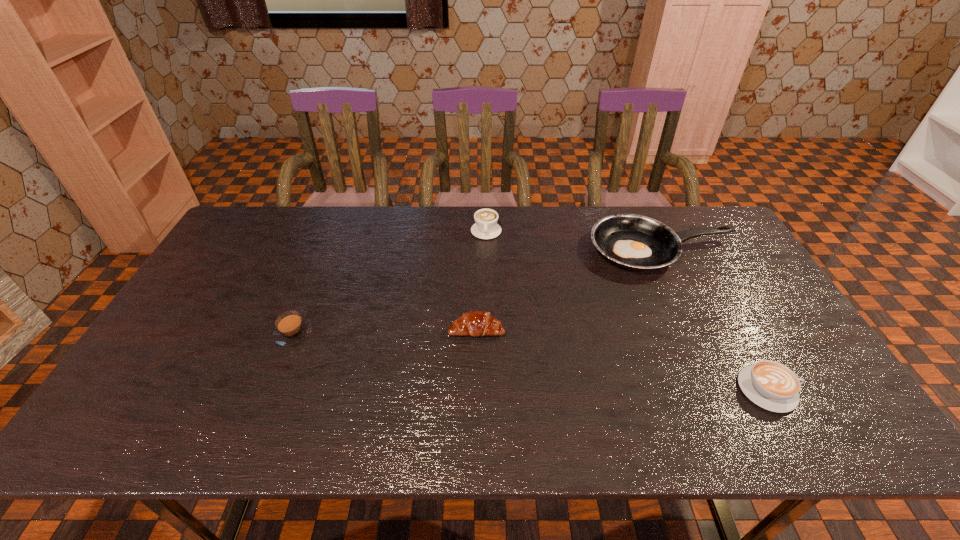
Find the location of a particular element. Image resolution: width=960 pixels, height=540 pixels. vacant area that satisfies the following two spatial constraints: 1. to the right of the frying pan's handle; 2. on the left side of the tallest cappuccino is located at coordinates (487, 250).